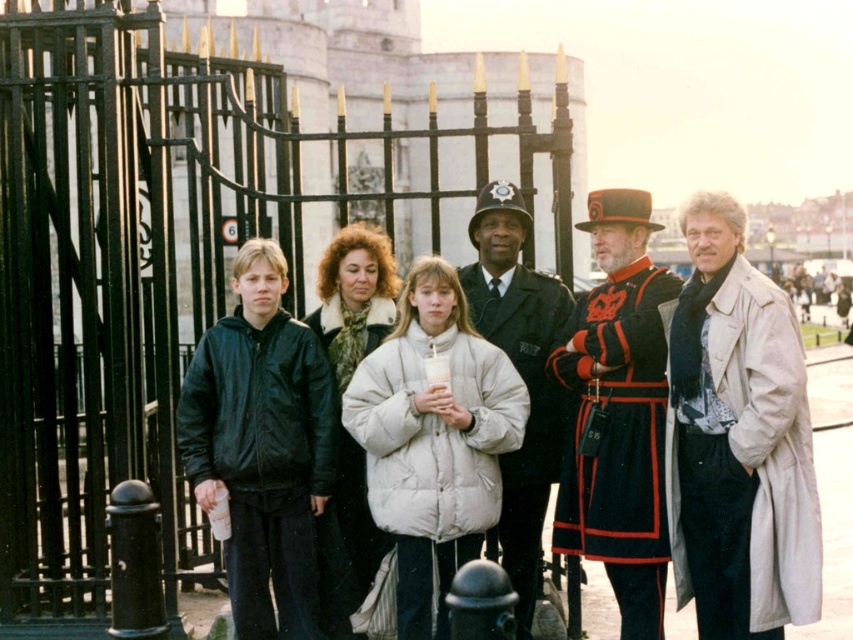
You are standing in front of the gate and want to take a photo. There are two points marked on the gate at coordinates point (x=476, y=502) and point (x=521, y=481). Which point should you focus on to ensure it appears larger in your photo?

Point (x=476, y=502) is closer to the camera than point (x=521, y=481), so focusing on point (x=476, y=502) will make it appear larger in the photo.

In the scene shown: You are a photographer trying to capture the group standing in front of the gate. You want to focus on the white puffy coat at center. Where should you aim your camera to ensure the point at coordinates point [433,438] is in the frame?

The point [433,438] is located on the white puffy coat at center, so aim the camera towards the center of the group where the white puffy coat at center is positioned to include that point in the frame.

You are a tour guide leading a group through a historic site. You need to move a 15 feet long ladder from the red velvet uniform at right to the black uniform at center. Can the ladder fit between them without bending?

The distance between the red velvet uniform at right and the black uniform at center is 16.80 feet, which is longer than the ladder. The ladder can fit between them without bending.